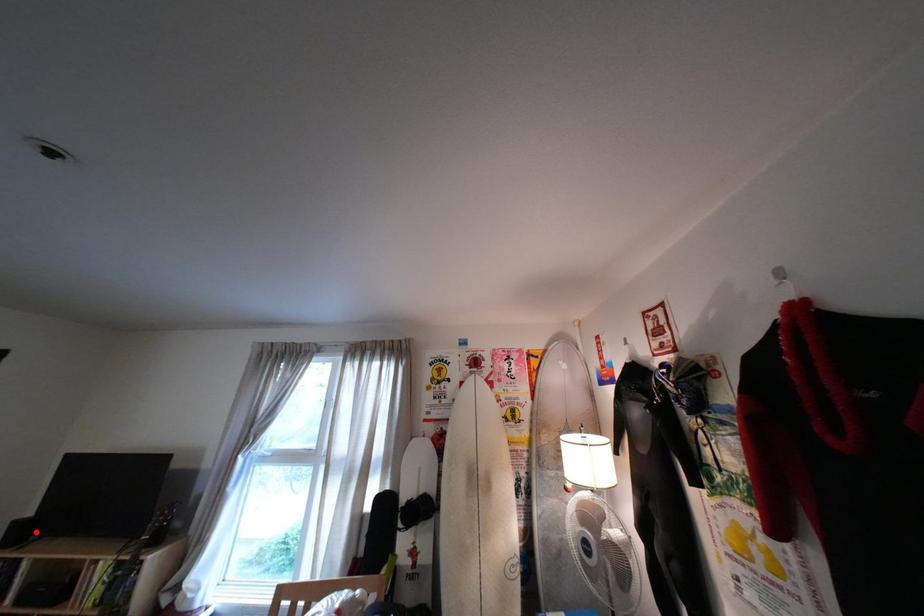
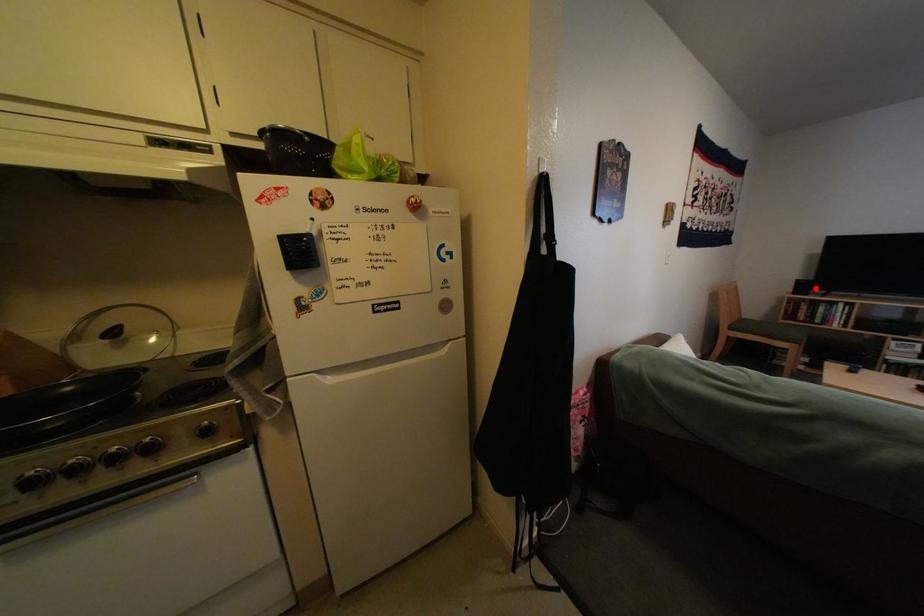
I am providing you with two images of the same scene from different viewpoints. A red point is marked on the first image and another point is marked on the second image. Is the marked point in image1 the same physical position as the marked point in image2?

Yes